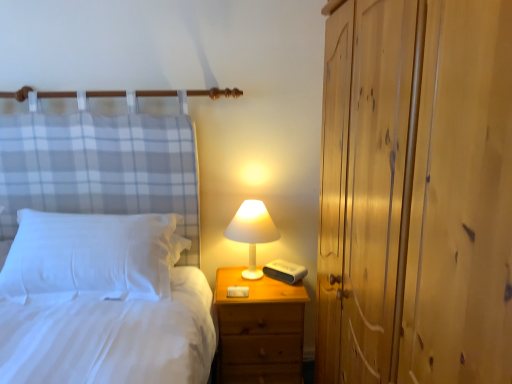
Question: In terms of height, does white matte table lamp at upper right look taller or shorter compared to white soft pillow at left?

Choices:
 (A) tall
 (B) short

Answer: (A)

Question: From the image's perspective, is white matte table lamp at upper right located above or below white soft pillow at left?

Choices:
 (A) below
 (B) above

Answer: (B)

Question: Considering the real-world distances, which object is closest to the white soft pillow at left?

Choices:
 (A) white matte table lamp at upper right
 (B) wooden dresser at right
 (C) wooden nightstand at right

Answer: (C)

Question: Estimate the real-world distances between objects in this image. Which object is farther from the white matte table lamp at upper right?

Choices:
 (A) wooden dresser at right
 (B) wooden nightstand at right
 (C) white soft pillow at left

Answer: (A)